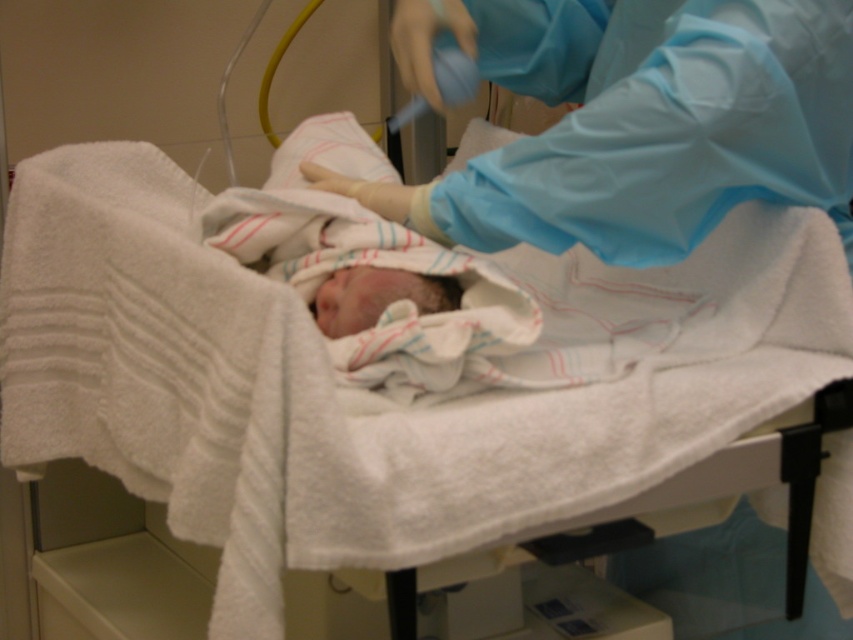
You are a nurse in the hospital room. You need to move from the point at coordinates point [807,172] to the point at coordinates point [323,316]. Which direction should you move in relation to the baby?

Point [807,172] is behind point [323,316], so to move from point [807,172] to point [323,316], you should move forward towards the baby.

From the picture: You are a nurse in a hospital room. You need to locate the blue smooth gown at upper right and the soft white swaddle at center. Which object is positioned higher in the image?

The blue smooth gown at upper right is positioned higher than the soft white swaddle at center in the image.

You are a nurse in the room and need to access the soft white swaddle at center for a checkup. Is the blue smooth gown at upper right blocking your direct path to it?

The blue smooth gown at upper right is to the right of the soft white swaddle at center, so it is not blocking the direct path. You can reach the soft white swaddle at center without moving the gown.